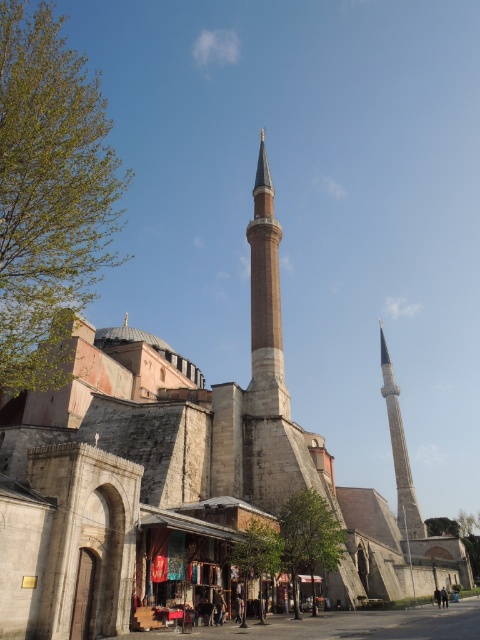
Is smooth stone minaret at center positioned in front of gray stone minaret at right?

Yes, it is in front of gray stone minaret at right.

Is smooth stone minaret at center positioned at the back of gray stone minaret at right?

No, it is in front of gray stone minaret at right.

Does point (274, 352) lie in front of point (402, 490)?

Yes, point (274, 352) is closer to viewer.

Where is `smooth stone minaret at center`? Image resolution: width=480 pixels, height=640 pixels. smooth stone minaret at center is located at coordinates pyautogui.click(x=264, y=280).